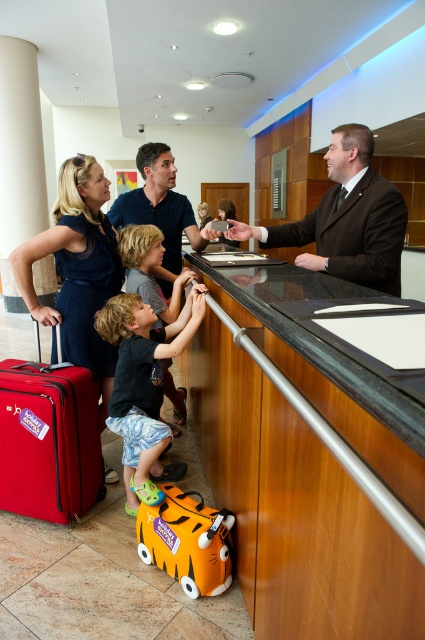
Does orange plastic suitcase at lower center have a smaller size compared to matte blue shirt at center?

Yes, orange plastic suitcase at lower center is smaller than matte blue shirt at center.

Who is shorter, orange plastic suitcase at lower center or matte blue shirt at center?

With less height is orange plastic suitcase at lower center.

Between point (144, 522) and point (156, 147), which one is positioned behind?

Point (156, 147)

Locate an element on the screen. orange plastic suitcase at lower center is located at coordinates [x=187, y=541].

Which is more to the left, polished granite counter at center or orange fabric suitcase at center?

orange fabric suitcase at center is more to the left.

Does polished granite counter at center have a larger size compared to orange fabric suitcase at center?

Indeed, polished granite counter at center has a larger size compared to orange fabric suitcase at center.

Image resolution: width=425 pixels, height=640 pixels. What are the coordinates of `polished granite counter at center` in the screenshot? It's located at (317, 339).

Between matte black dress at center and black matte shirt at center, which one appears on the right side from the viewer's perspective?

black matte shirt at center is more to the right.

Between point (68, 266) and point (198, 292), which one is positioned in front?

Point (198, 292) is in front.

Is point (101, 285) in front of point (156, 369)?

No, it is behind (156, 369).

I want to click on matte black dress at center, so click(x=76, y=269).